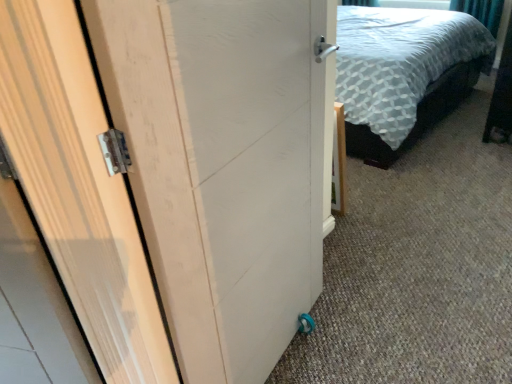
What do you see at coordinates (224, 165) in the screenshot? This screenshot has height=384, width=512. I see `white wood door at center` at bounding box center [224, 165].

Locate an element on the screen. This screenshot has height=384, width=512. white wood door at center is located at coordinates (224, 165).

Locate an element on the screen. white wood door at center is located at coordinates (224, 165).